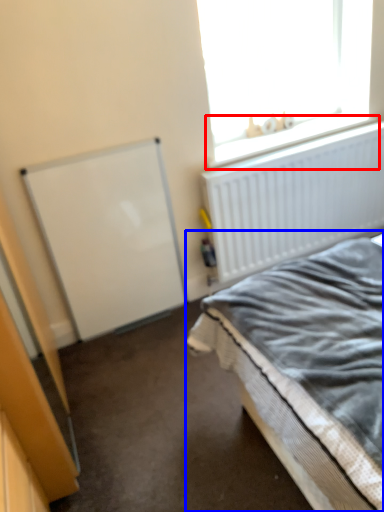
Question: Which object is further to the camera taking this photo, window sill (highlighted by a red box) or bed (highlighted by a blue box)?

Choices:
 (A) window sill
 (B) bed

Answer: (A)